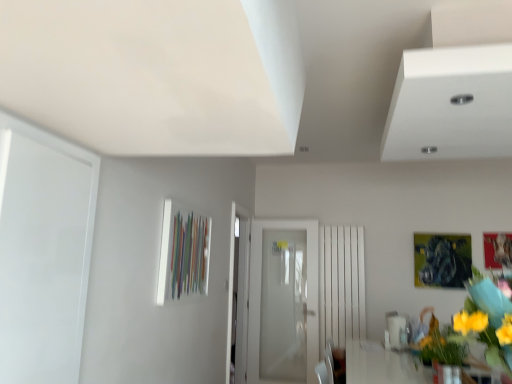
Question: Does yellow fabric flower at right touch white frosted glass door at center?

Choices:
 (A) no
 (B) yes

Answer: (A)

Question: Is white frosted glass door at center inside yellow fabric flower at right?

Choices:
 (A) yes
 (B) no

Answer: (B)

Question: Can you confirm if yellow fabric flower at right is taller than white frosted glass door at center?

Choices:
 (A) no
 (B) yes

Answer: (A)

Question: Is yellow fabric flower at right further to camera compared to white frosted glass door at center?

Choices:
 (A) no
 (B) yes

Answer: (A)

Question: Is yellow fabric flower at right to the left of white frosted glass door at center from the viewer's perspective?

Choices:
 (A) yes
 (B) no

Answer: (B)

Question: From the image's perspective, does yellow fabric flower at right appear lower than white frosted glass door at center?

Choices:
 (A) no
 (B) yes

Answer: (A)

Question: Is there a large distance between white frosted glass door at center and yellow fabric flower at right?

Choices:
 (A) yes
 (B) no

Answer: (A)

Question: Can you confirm if white frosted glass door at center is positioned to the left of yellow fabric flower at right?

Choices:
 (A) yes
 (B) no

Answer: (A)

Question: Can you confirm if white frosted glass door at center is bigger than yellow fabric flower at right?

Choices:
 (A) no
 (B) yes

Answer: (B)

Question: Considering the relative sizes of white frosted glass door at center and yellow fabric flower at right in the image provided, is white frosted glass door at center smaller than yellow fabric flower at right?

Choices:
 (A) no
 (B) yes

Answer: (A)

Question: Are white frosted glass door at center and yellow fabric flower at right beside each other?

Choices:
 (A) yes
 (B) no

Answer: (B)

Question: Is white frosted glass door at center oriented towards yellow fabric flower at right?

Choices:
 (A) no
 (B) yes

Answer: (A)

Question: From the image's perspective, relative to white frosted glass door at center, is yellow fabric flower at right above or below?

Choices:
 (A) below
 (B) above

Answer: (B)